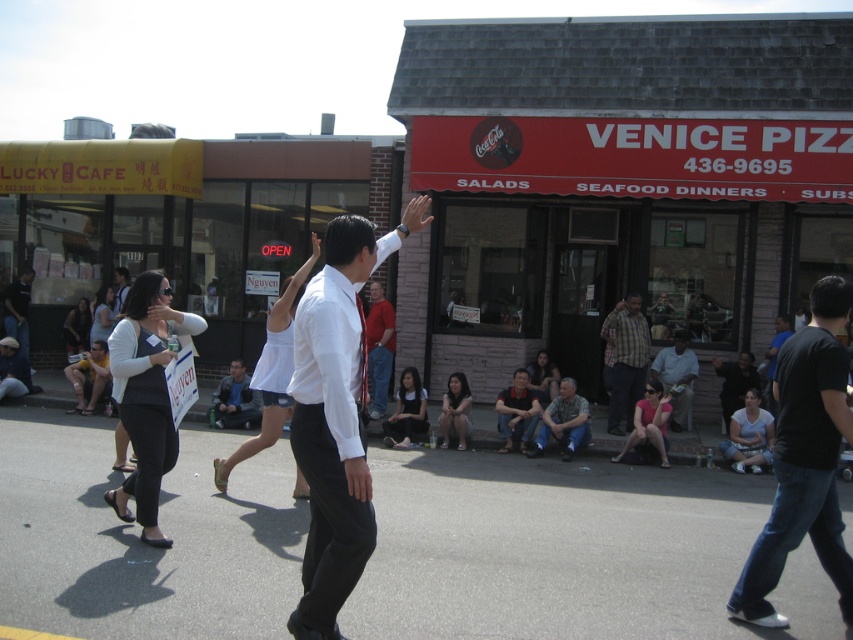
Does light brown leather jacket at center have a smaller size compared to dark blue jeans at lower left?

Yes.

Is light brown leather jacket at center taller than dark blue jeans at lower left?

No, light brown leather jacket at center is not taller than dark blue jeans at lower left.

Does point (677, 422) come in front of point (4, 296)?

Yes, point (677, 422) is in front of point (4, 296).

Where is `light brown leather jacket at center`? light brown leather jacket at center is located at coordinates (676, 376).

Which is in front, point (811, 326) or point (451, 392)?

Positioned in front is point (811, 326).

The height and width of the screenshot is (640, 853). What do you see at coordinates (804, 460) in the screenshot?
I see `black cotton shirt at center` at bounding box center [804, 460].

This screenshot has width=853, height=640. I want to click on black cotton shirt at center, so click(x=804, y=460).

Between camouflage fabric shirt at lower center and dark blue jeans at lower left, which one has more height?

Standing taller between the two is dark blue jeans at lower left.

Does camouflage fabric shirt at lower center have a lesser height compared to dark blue jeans at lower left?

Correct, camouflage fabric shirt at lower center is not as tall as dark blue jeans at lower left.

This screenshot has width=853, height=640. Identify the location of camouflage fabric shirt at lower center. (563, 420).